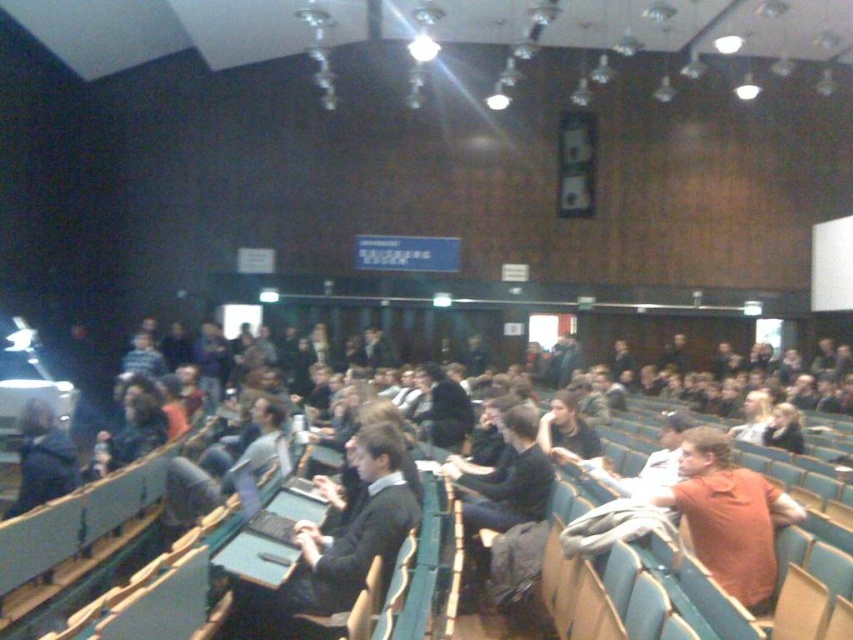
Who is positioned more to the left, orange matte shirt at center or dark blue jacket at center?

dark blue jacket at center is more to the left.

Who is more forward, (747, 548) or (41, 474)?

Point (747, 548)

I want to click on orange matte shirt at center, so click(729, 516).

Can you confirm if dark gray sweater at center is positioned below dark blue jacket at center?

No.

Between dark gray sweater at center and dark blue jacket at center, which one has less height?

dark blue jacket at center

Does point (379, 429) come in front of point (55, 480)?

Yes, it is.

Locate an element on the screen. The width and height of the screenshot is (853, 640). dark gray sweater at center is located at coordinates (335, 548).

In the scene shown: Can you confirm if dark gray sweater at center is bigger than orange matte shirt at center?

Indeed, dark gray sweater at center has a larger size compared to orange matte shirt at center.

Who is taller, dark gray sweater at center or orange matte shirt at center?

With more height is dark gray sweater at center.

Is point (311, 544) in front of point (723, 566)?

Yes, point (311, 544) is closer to viewer.

Image resolution: width=853 pixels, height=640 pixels. I want to click on dark gray sweater at center, so click(x=335, y=548).